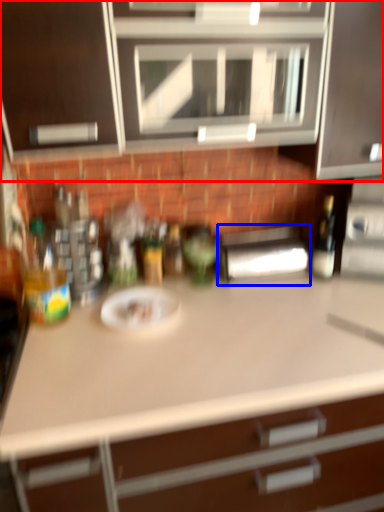
Question: Among these objects, which one is nearest to the camera, cabinetry (highlighted by a red box) or appliance (highlighted by a blue box)?

Choices:
 (A) cabinetry
 (B) appliance

Answer: (A)